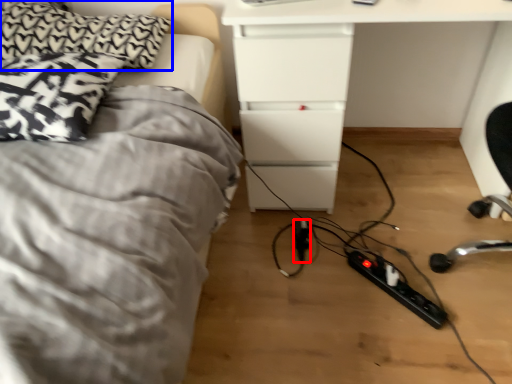
Question: Which point is further to the camera, extension cord (highlighted by a red box) or pillow (highlighted by a blue box)?

Choices:
 (A) extension cord
 (B) pillow

Answer: (A)